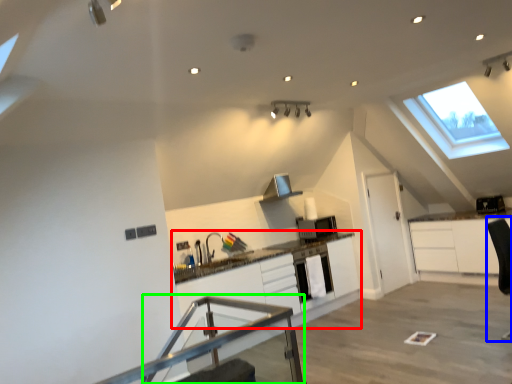
Question: Estimate the real-world distances between objects in this image. Which object is closer to cabinetry (highlighted by a red box), swivel chair (highlighted by a blue box) or table (highlighted by a green box)?

Choices:
 (A) swivel chair
 (B) table

Answer: (B)